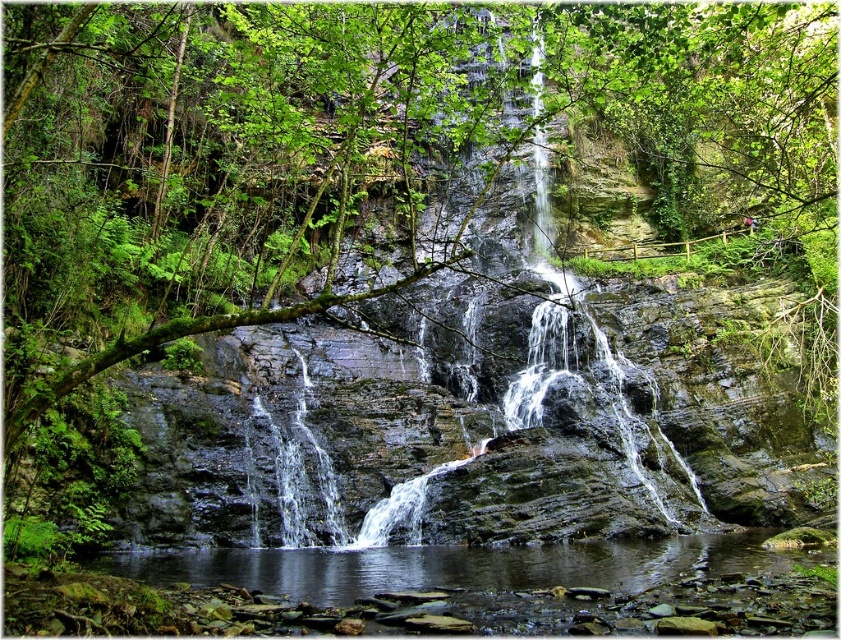
You are standing at the edge of the cliff overlooking the scene. Which object, the smooth rock waterfall at center or the clear water at bottom, is nearer to you?

The smooth rock waterfall at center is closer to the viewer than the clear water at bottom, so it is nearer to you.

You are a geologist examining the scene. You need to locate the smooth rock waterfall at center. Where would you find it?

The smooth rock waterfall at center is located at point (459, 401).